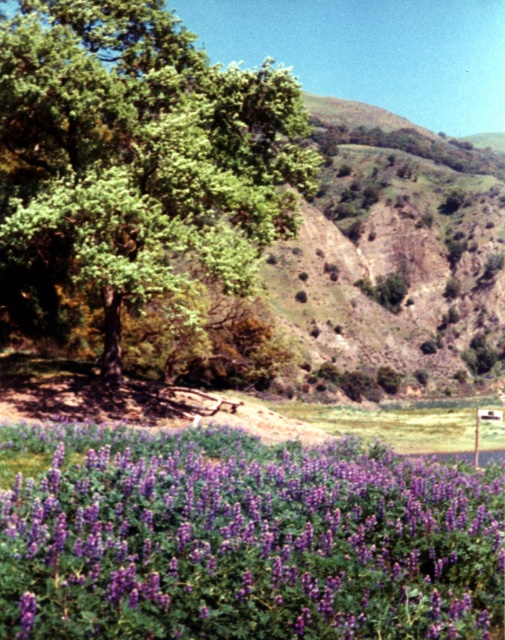
You are a hiker who wants to take a photo of the green leafy tree at upper left and the white plastic street sign at lower right. Which object should you focus on first if you want both to be in sharp focus?

You should focus on the green leafy tree at upper left first because it is larger than the white plastic street sign at lower right, so focusing on the larger object will help ensure both are in focus.

You are standing in the vibrant natural landscape and want to walk from the point closer to you to the point further away. Which path would you take between the two points, point (209, 476) and point (498, 419), and why?

You should take the path leading from point (209, 476) to point (498, 419) because point (209, 476) is closer to the viewer, and point (498, 419) is further away. This means the path goes from the foreground towards the background of the scene.

You are a hiker standing in the middle of the purple flower field. You see the green leafy tree at upper left and the white plastic street sign at lower right. Which object is located to the left of the other?

The green leafy tree at upper left is positioned on the left side of the white plastic street sign at lower right.